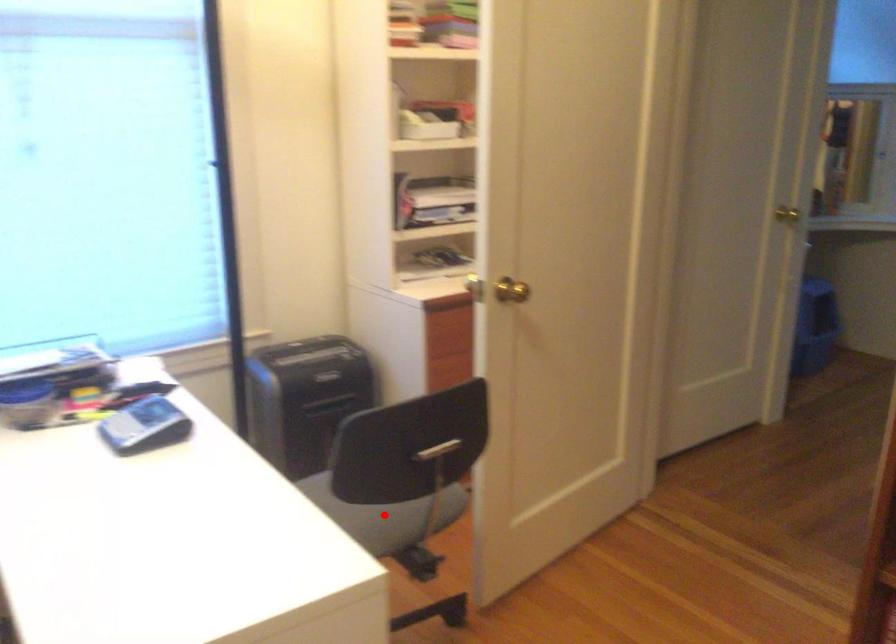
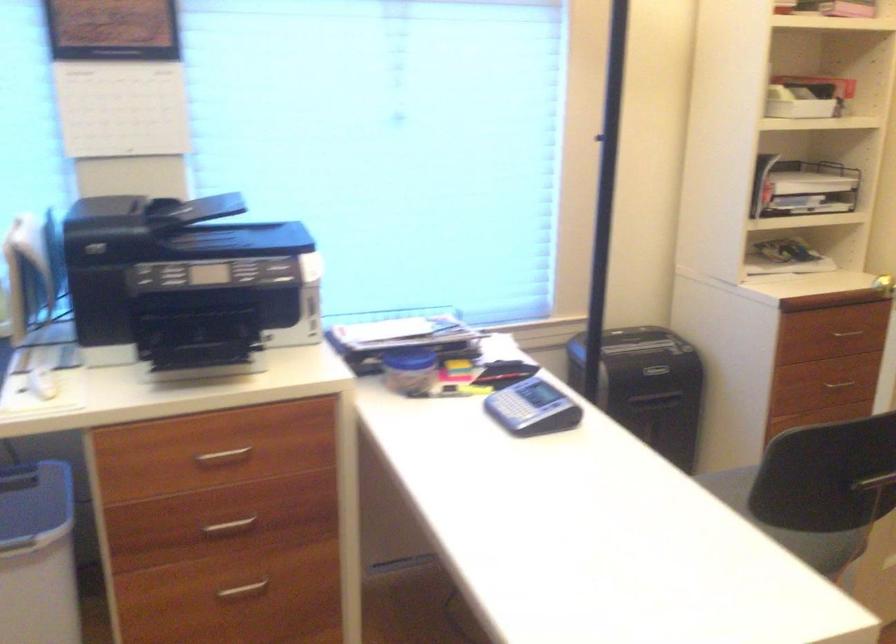
Question: I am providing you with two images of the same scene from different viewpoints. Given a red point in image1, look at the same physical point in image2. Is it:

Choices:
 (A) Closer to the viewpoint
 (B) Farther from the viewpoint

Answer: (A)